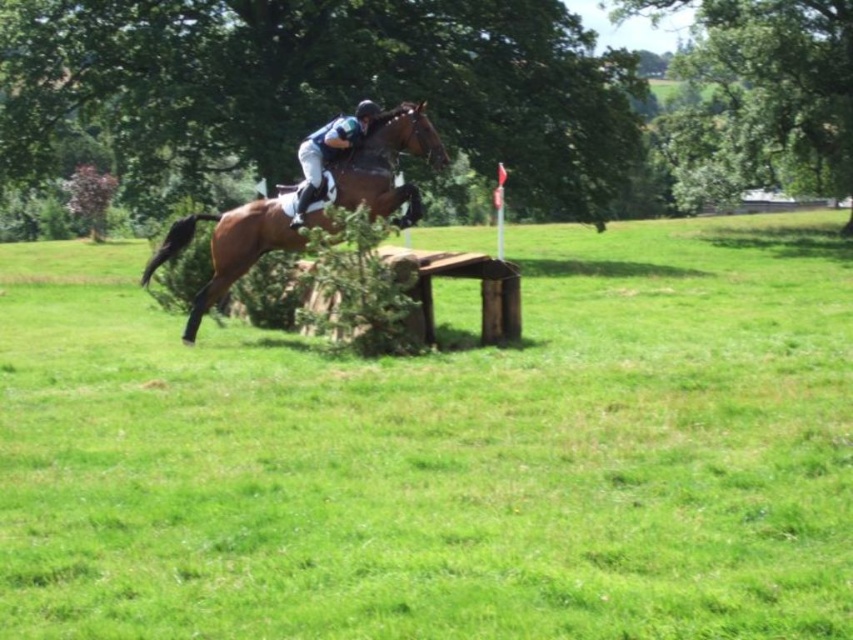
Based on the photo, you are a photographer positioned at the point with coordinates (x=442, y=451). You want to capture a photo of the brown wooden fence at center. Is the fence within your current field of view?

The point (x=442, y=451) indicates the brown wooden fence at center, so yes, the fence is directly at your current position and within your field of view.

You are a spectator at the equestrian event and want to know if the brown glossy horse at center can jump over the brown wooden fence at center. Based on their heights, can it clear the fence?

The brown wooden fence at center has a greater height compared to the brown glossy horse at center, so the horse may not be able to clear the fence if its jumping height capability is less than the fence height.

You are a photographer standing at the edge of the field and want to capture a photo of the brown glossy horse at center and the shiny blue helmet at center. Which object should you focus on first to ensure both are in sharp focus?

The brown glossy horse at center is closer to the viewer than the shiny blue helmet at center, so you should focus on the brown glossy horse at center first to ensure both are in sharp focus.